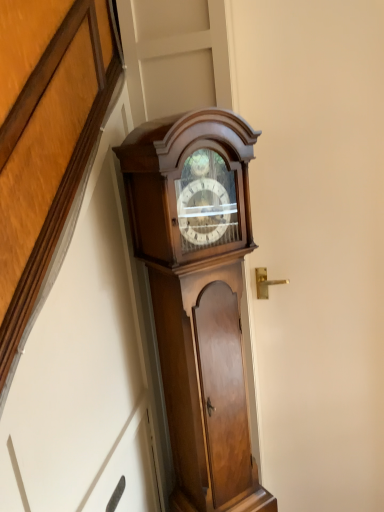
Find the location of a particular element. The image size is (384, 512). polished wood grandfather clock at center is located at coordinates (198, 296).

This screenshot has width=384, height=512. What do you see at coordinates (198, 296) in the screenshot? I see `polished wood grandfather clock at center` at bounding box center [198, 296].

Locate an element on the screen. This screenshot has width=384, height=512. polished wood grandfather clock at center is located at coordinates (198, 296).